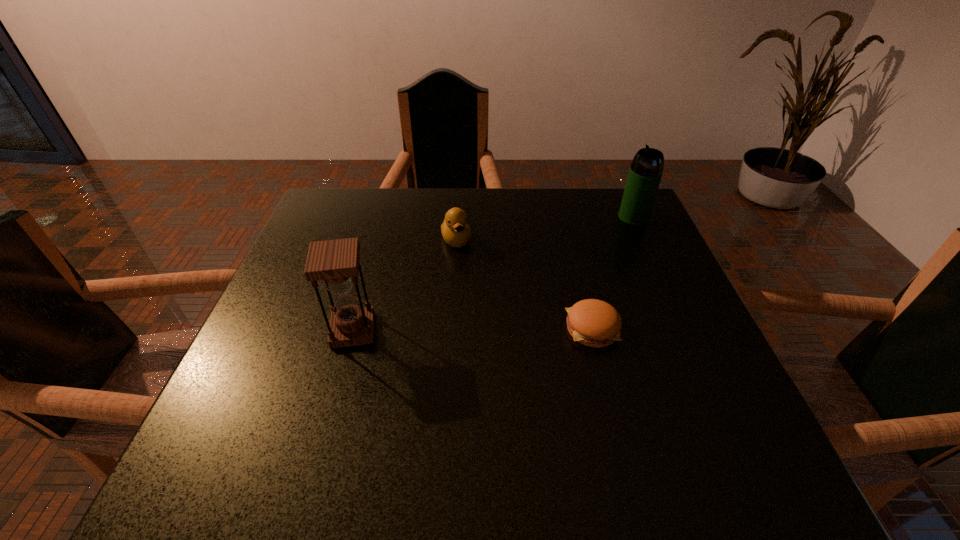
Locate an element on the screen. The height and width of the screenshot is (540, 960). free space that satisfies the following two spatial constraints: 1. on the front side of the patty; 2. on the right side of the third nearest object is located at coordinates (450, 329).

The height and width of the screenshot is (540, 960). In order to click on free space that satisfies the following two spatial constraints: 1. on the back side of the leftmost object; 2. on the left side of the duckling in this screenshot , I will do `click(378, 240)`.